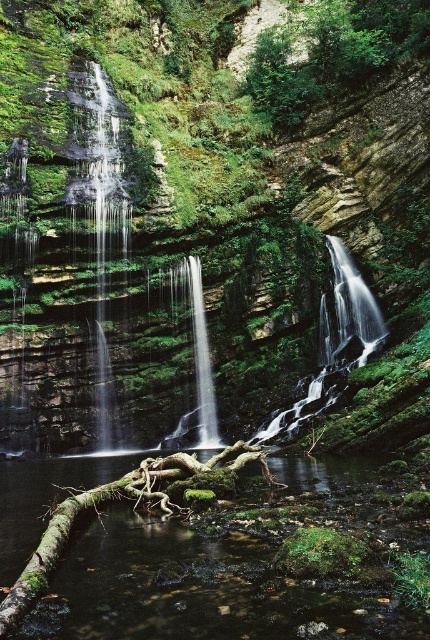
Question: Based on their relative distances, which object is nearer to the translucent glass waterfall at center?

Choices:
 (A) green mossy log at center
 (B) green leafy tree at upper center

Answer: (B)

Question: Among these objects, which one is nearest to the camera?

Choices:
 (A) green leafy tree at upper center
 (B) clear glass waterfall at center
 (C) green mossy log at center
 (D) translucent glass waterfall at center

Answer: (C)

Question: Is green mossy log at center further to camera compared to clear glass waterfall at center?

Choices:
 (A) yes
 (B) no

Answer: (B)

Question: Is green mossy log at center closer to camera compared to green leafy tree at upper center?

Choices:
 (A) no
 (B) yes

Answer: (B)

Question: Which point is closer to the camera?

Choices:
 (A) translucent glass waterfall at center
 (B) clear glass waterfall at center
 (C) green mossy log at center
 (D) green leafy tree at upper center

Answer: (C)

Question: Can you confirm if green mossy log at center is positioned above clear glass waterfall at center?

Choices:
 (A) no
 (B) yes

Answer: (A)